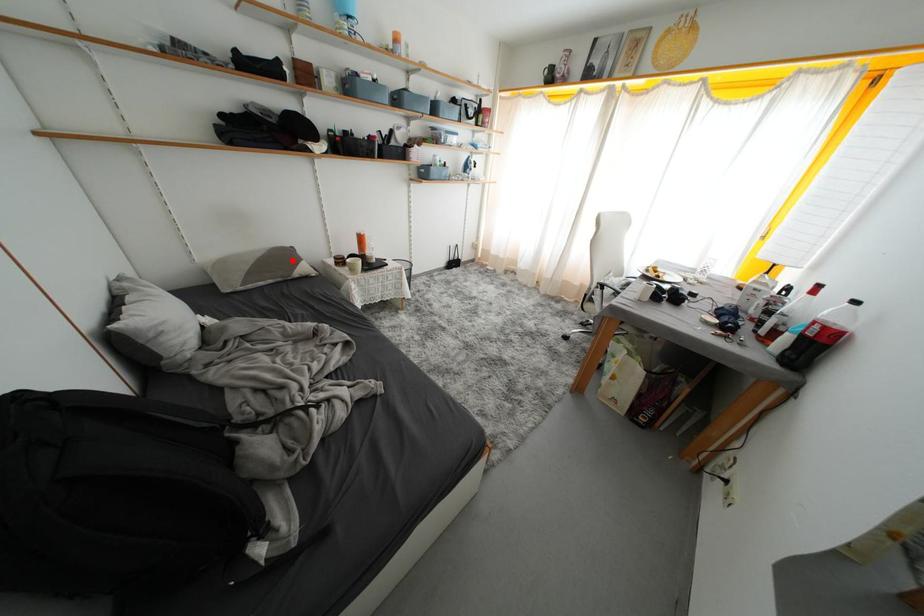
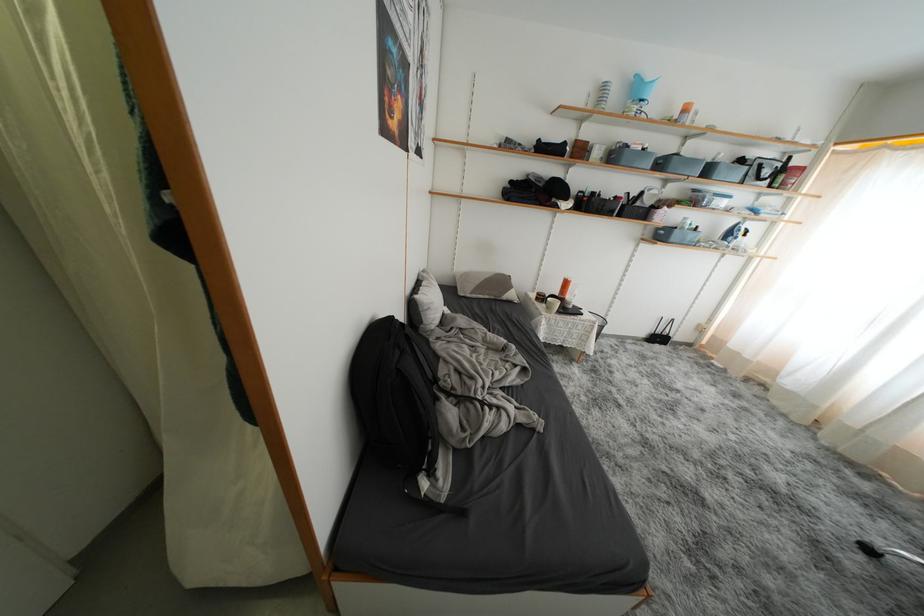
The point at the highlighted location is marked in the first image. Where is the corresponding point in the second image?

(508, 286)